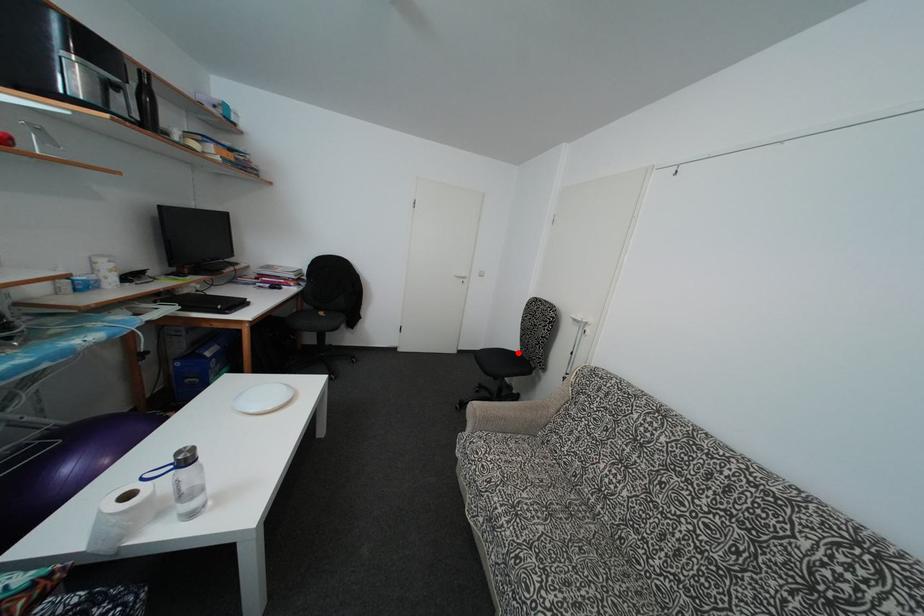
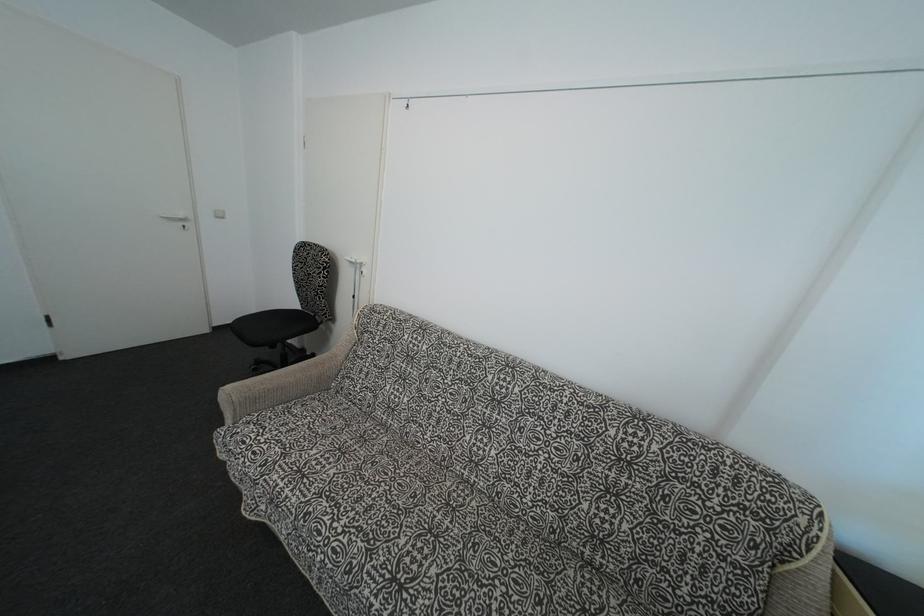
Where in the second image is the point corresponding to the highlighted location from the first image?

(297, 310)